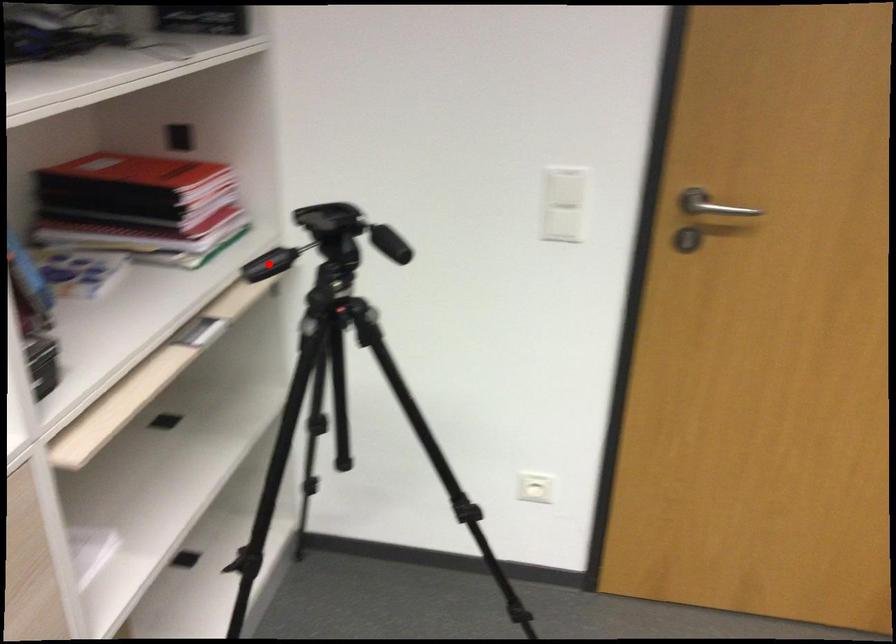
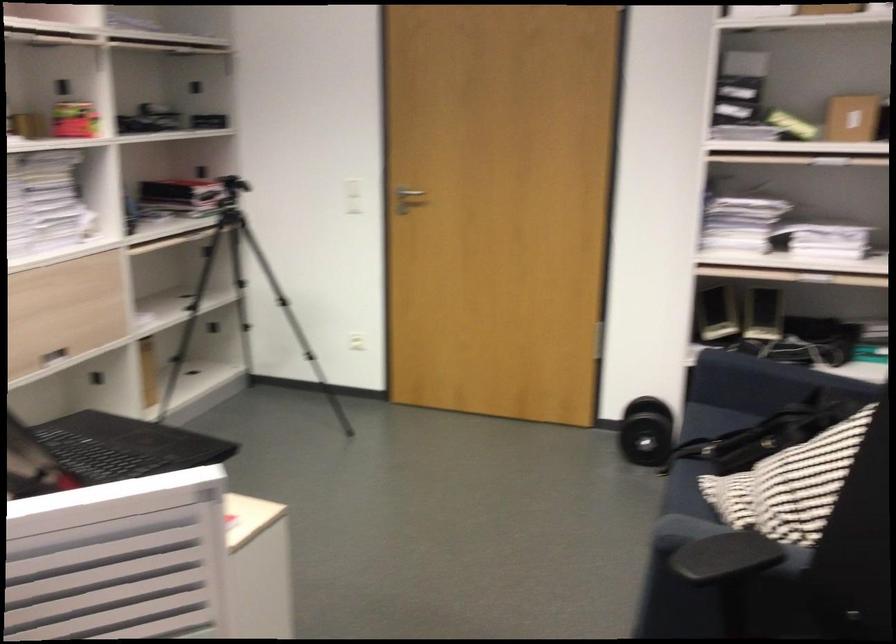
Question: I am providing you with two images of the same scene from different viewpoints. A red point is marked on the first image. At the location where the point appears in image 1, is it still visible in image 2?

Choices:
 (A) Yes
 (B) No

Answer: (B)